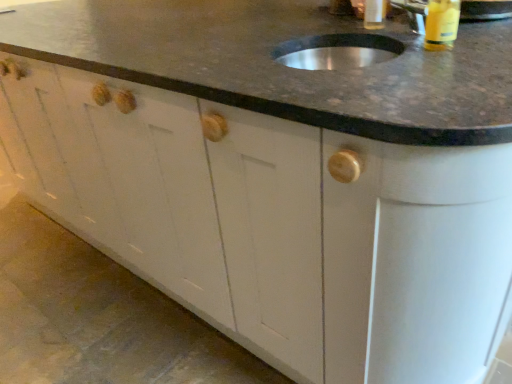
Question: From the image's perspective, is metallic silver sink at upper center on yellow plastic bottle at upper right, the 1th beverage in the front-to-back sequence?

Choices:
 (A) no
 (B) yes

Answer: (B)

Question: From the image's perspective, is metallic silver sink at upper center under yellow plastic bottle at upper right, which is counted as the second beverage, starting from the back?

Choices:
 (A) no
 (B) yes

Answer: (A)

Question: Considering the relative positions of metallic silver sink at upper center and yellow plastic bottle at upper right, the 1th beverage in the front-to-back sequence, in the image provided, is metallic silver sink at upper center to the right of yellow plastic bottle at upper right, the 1th beverage in the front-to-back sequence, from the viewer's perspective?

Choices:
 (A) no
 (B) yes

Answer: (A)

Question: Is metallic silver sink at upper center with yellow plastic bottle at upper right, which is counted as the second beverage, starting from the back?

Choices:
 (A) yes
 (B) no

Answer: (B)

Question: Can you confirm if metallic silver sink at upper center is bigger than yellow plastic bottle at upper right, positioned as the 1th beverage in right-to-left order?

Choices:
 (A) no
 (B) yes

Answer: (B)

Question: Can you confirm if metallic silver sink at upper center is taller than yellow plastic bottle at upper right, the 1th beverage in the front-to-back sequence?

Choices:
 (A) yes
 (B) no

Answer: (B)

Question: Is translucent plastic bottle at upper center, positioned as the 1th beverage in left-to-right order, thinner than metallic silver sink at upper center?

Choices:
 (A) yes
 (B) no

Answer: (A)

Question: Can you confirm if translucent plastic bottle at upper center, which is the first beverage from back to front, is wider than metallic silver sink at upper center?

Choices:
 (A) yes
 (B) no

Answer: (B)

Question: From the image's perspective, is translucent plastic bottle at upper center, which appears as the 2th beverage when viewed from the front, located above metallic silver sink at upper center?

Choices:
 (A) no
 (B) yes

Answer: (B)

Question: Considering the relative sizes of translucent plastic bottle at upper center, which is the first beverage from back to front, and metallic silver sink at upper center in the image provided, is translucent plastic bottle at upper center, which is the first beverage from back to front, smaller than metallic silver sink at upper center?

Choices:
 (A) no
 (B) yes

Answer: (B)

Question: Can you confirm if translucent plastic bottle at upper center, acting as the second beverage starting from the right, is shorter than metallic silver sink at upper center?

Choices:
 (A) yes
 (B) no

Answer: (B)

Question: Is metallic silver sink at upper center at the back of translucent plastic bottle at upper center, which is the first beverage from back to front?

Choices:
 (A) no
 (B) yes

Answer: (B)

Question: Is translucent plastic bottle at upper center, which appears as the 2th beverage when viewed from the front, looking in the opposite direction of yellow plastic bottle at upper right, which is the second beverage in left-to-right order?

Choices:
 (A) no
 (B) yes

Answer: (A)